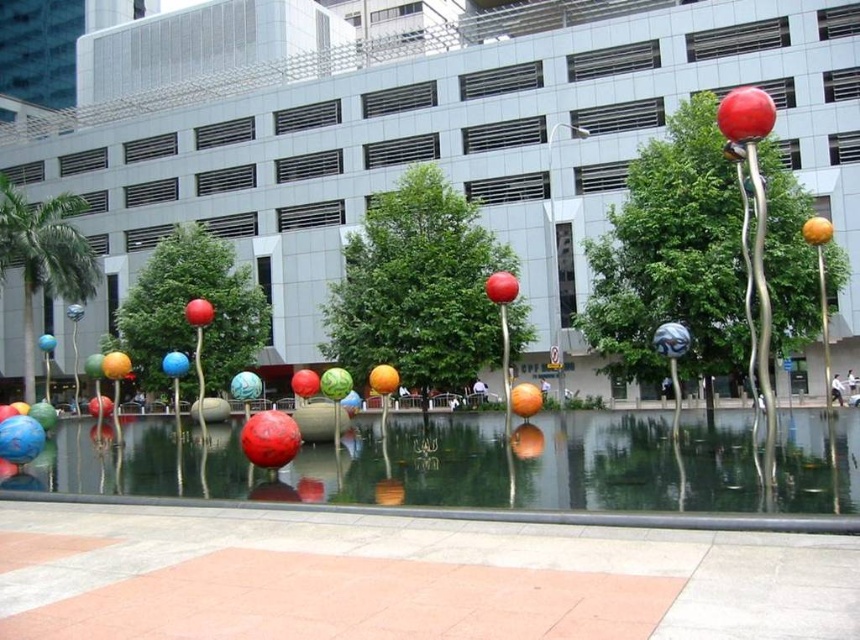
You are standing in the plaza and want to take a photo of the shiny metallic sphere at upper right. If your camera has a maximum focus range of 7 meters, will you need to move closer to get a clear shot?

The shiny metallic sphere at upper right is 7.75 meters from viewer. Since this distance exceeds the camera maximum focus range of 7 meters, you need to move closer to reduce the distance to within 7 meters for a clear photo.

You are a photographer planning to capture the sculpture installation in the plaza. You want to ensure that both the glossy metallic water at center and the shiny metallic sphere at upper right are clearly visible in your shot. Based on their sizes, which object might require you to adjust your camera angle to include it fully in the frame?

The glossy metallic water at center might be wider than the shiny metallic sphere at upper right, so you may need to adjust your camera angle to ensure the wider glossy metallic water at center fits entirely within the frame.

You are standing in the plaza and want to take a photo of the shiny metallic sphere at center and the glossy metallic water at center. Which object should you position to your left to include both in the frame?

You should position the shiny metallic sphere at center to your left since the glossy metallic water at center is to the right of it.